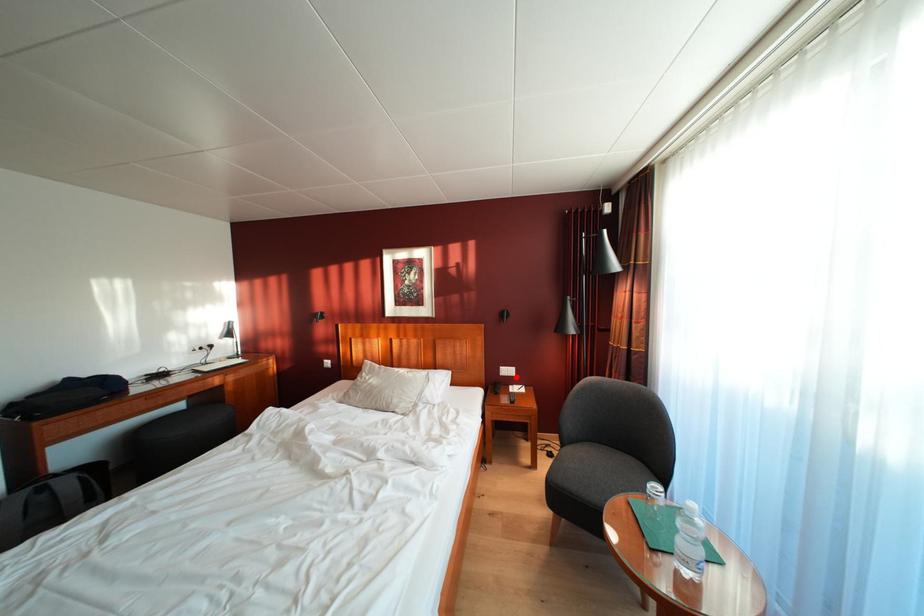
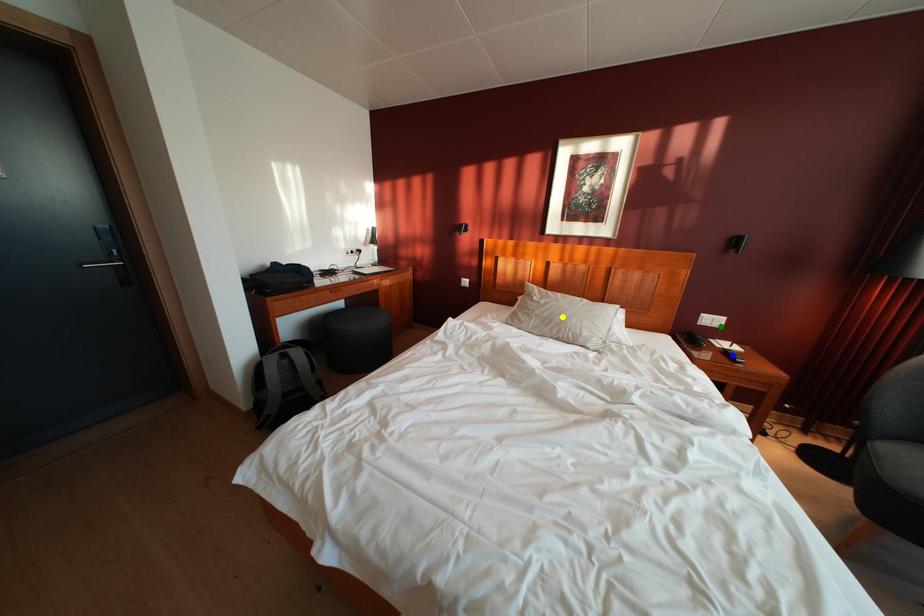
Question: I am providing you with two images of the same scene from different viewpoints. A red point is marked on the first image. You are given multiple points on the second image. Which point in image 2 is actually the same real-world point as the red point in image 1?

Choices:
 (A) green point
 (B) yellow point
 (C) blue point

Answer: (A)